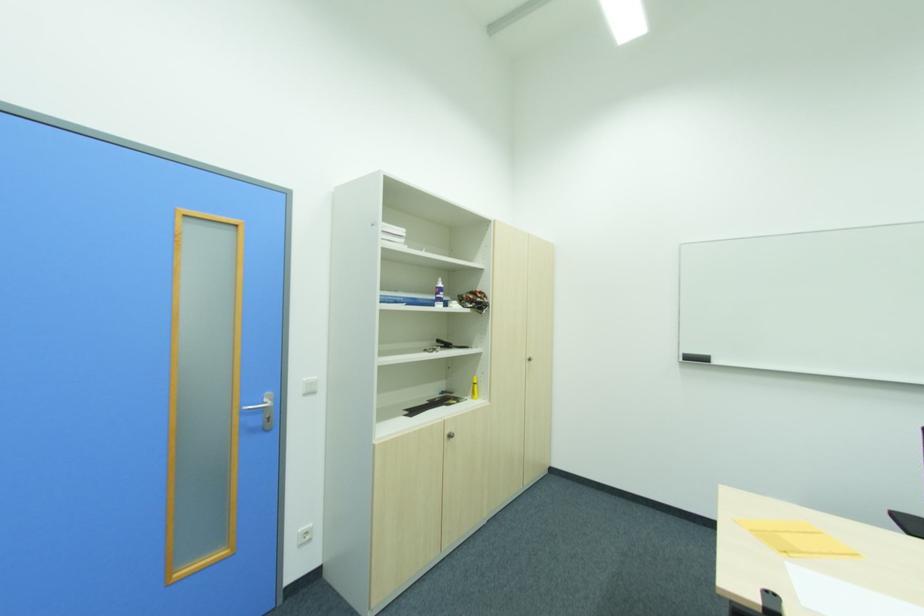
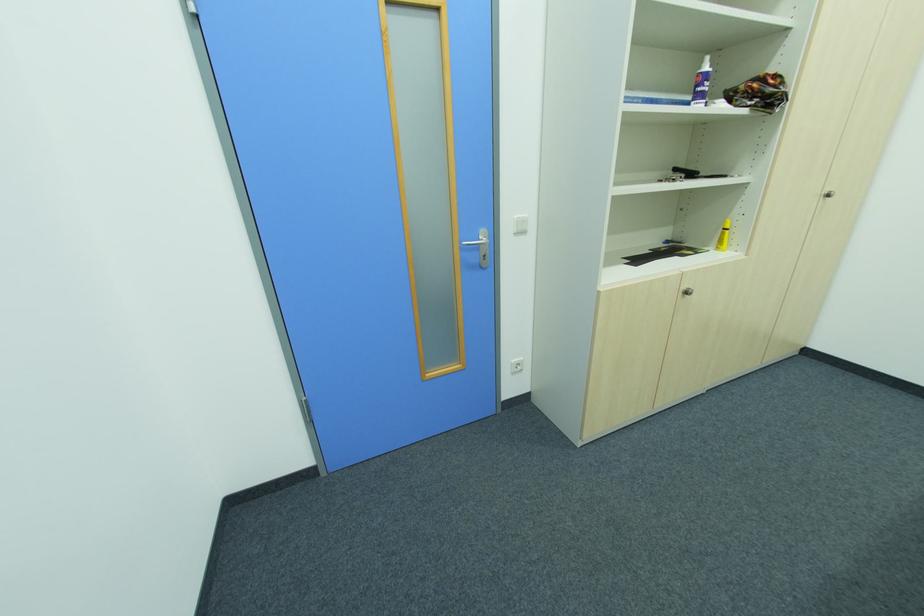
Where in the second image is the point corresponding to (x=530, y=361) from the first image?

(822, 198)